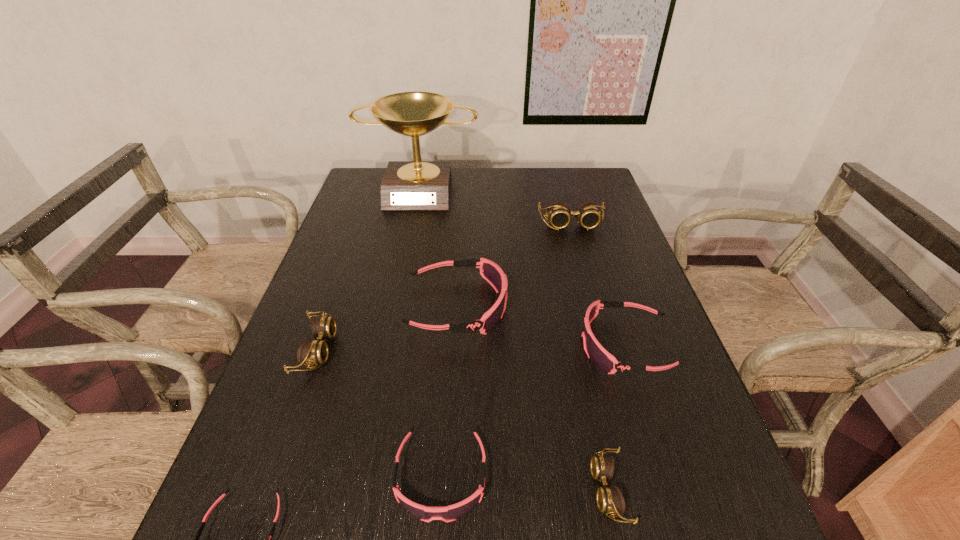
Image resolution: width=960 pixels, height=540 pixels. In order to click on object located in the far edge section of the desktop in this screenshot , I will do `click(407, 185)`.

Where is `award situated at the left edge`? award situated at the left edge is located at coordinates (407, 185).

I want to click on goggles that is at the left edge, so click(x=310, y=352).

Identify the location of object at the far left corner. (407, 185).

In the image, there is a desktop. Where is `vacant space at the far edge`? This screenshot has height=540, width=960. vacant space at the far edge is located at coordinates (520, 178).

Locate an element on the screen. This screenshot has width=960, height=540. free space at the near edge of the desktop is located at coordinates (504, 536).

This screenshot has width=960, height=540. I want to click on blank space at the left edge, so click(x=348, y=308).

Identify the location of free space at the far left corner of the desktop. pos(370,188).

This screenshot has height=540, width=960. I want to click on free space at the far right corner, so click(570, 194).

Where is `free space between the second smallest brown goggles and the biggest brown goggles`? Image resolution: width=960 pixels, height=540 pixels. free space between the second smallest brown goggles and the biggest brown goggles is located at coordinates (444, 287).